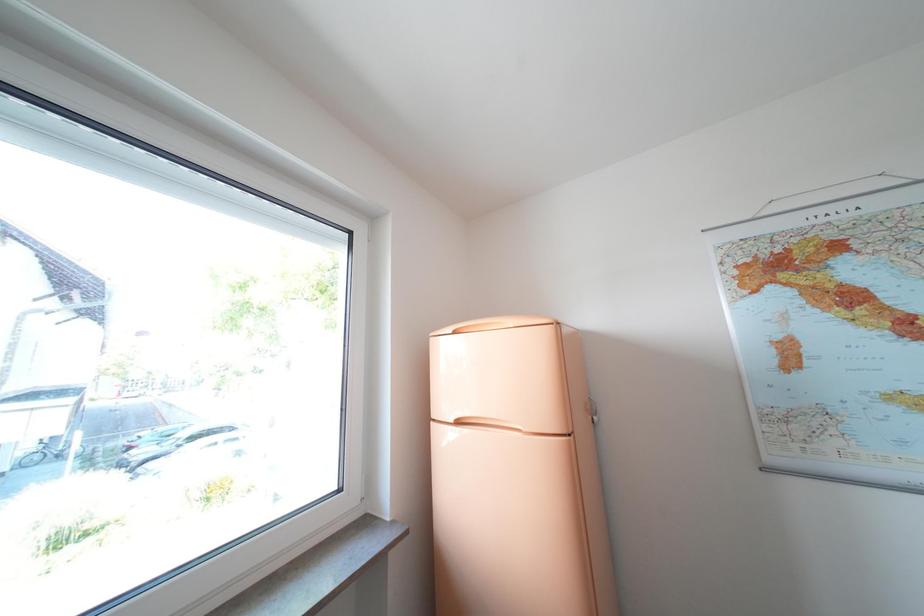
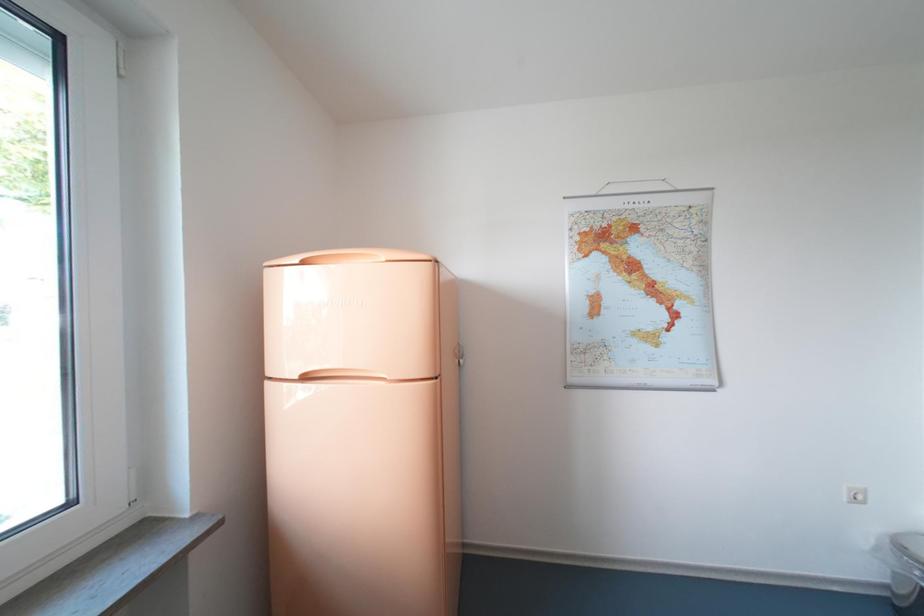
Question: The camera is either moving clockwise (left) or counter-clockwise (right) around the object. The first image is from the beginning of the video and the second image is from the end. Is the camera moving left or right when shooting the video?

Choices:
 (A) Left
 (B) Right

Answer: (A)